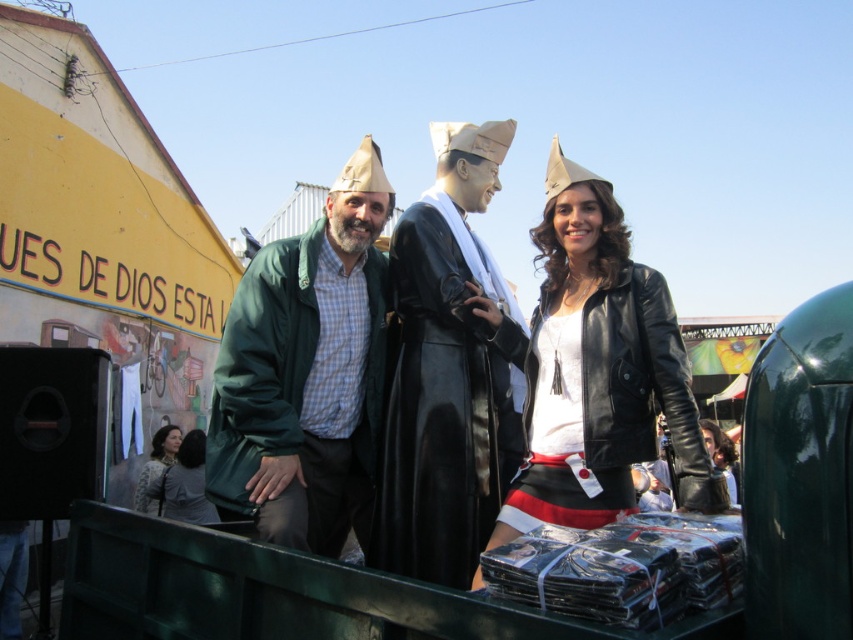
You are a GUI agent. You are given a task and a screenshot of the screen. Output one action in this format:
    pyautogui.click(x=<x>, y=<y>)
    Task: Click on the green matte jacket at center
    This screenshot has width=853, height=640.
    Given the screenshot: What is the action you would take?
    pyautogui.click(x=306, y=372)

Who is positioned more to the left, green matte jacket at center or leather jacket at center?

From the viewer's perspective, green matte jacket at center appears more on the left side.

Is point (219, 484) closer to viewer compared to point (671, 387)?

No, (219, 484) is behind (671, 387).

Find the location of a particular element. green matte jacket at center is located at coordinates (306, 372).

Which is behind, point (448, 362) or point (728, 467)?

Positioned behind is point (728, 467).

The image size is (853, 640). I want to click on matte black coat at center, so click(521, 371).

Looking at this image, who is positioned more to the right, shiny black coat at center or light brown textured coat at lower left?

shiny black coat at center

Between shiny black coat at center and light brown textured coat at lower left, which one appears on the left side from the viewer's perspective?

From the viewer's perspective, light brown textured coat at lower left appears more on the left side.

Is point (476, 333) closer to camera compared to point (146, 493)?

Yes, it is in front of point (146, 493).

You are a GUI agent. You are given a task and a screenshot of the screen. Output one action in this format:
    pyautogui.click(x=<x>, y=<y>)
    Task: Click on the shiny black coat at center
    This screenshot has width=853, height=640.
    Given the screenshot: What is the action you would take?
    pyautogui.click(x=448, y=371)